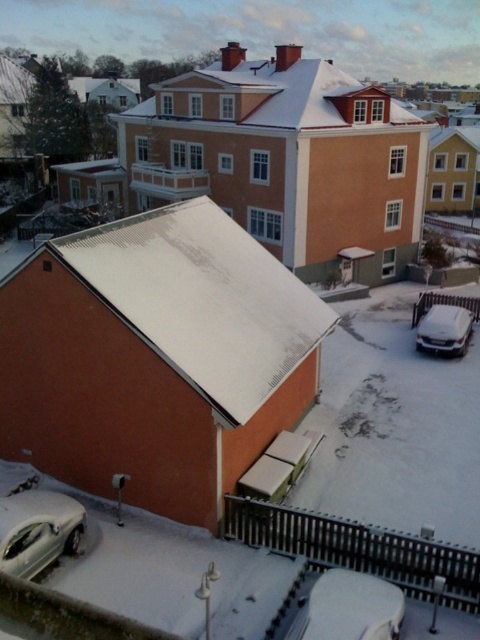
Question: Which object is the closest to the white matte car at lower center?

Choices:
 (A) silver metallic car at lower left
 (B) white matte car at lower right

Answer: (A)

Question: Does white matte car at lower center appear on the right side of white matte car at lower right?

Choices:
 (A) yes
 (B) no

Answer: (B)

Question: Which point is closer to the camera?

Choices:
 (A) white matte car at lower center
 (B) silver metallic car at lower left
 (C) white matte car at lower right

Answer: (A)

Question: Does white matte car at lower center appear under white matte car at lower right?

Choices:
 (A) yes
 (B) no

Answer: (A)

Question: Is silver metallic car at lower left below white matte car at lower right?

Choices:
 (A) yes
 (B) no

Answer: (A)

Question: Considering the real-world distances, which object is farthest from the white matte car at lower center?

Choices:
 (A) white matte car at lower right
 (B) silver metallic car at lower left

Answer: (A)